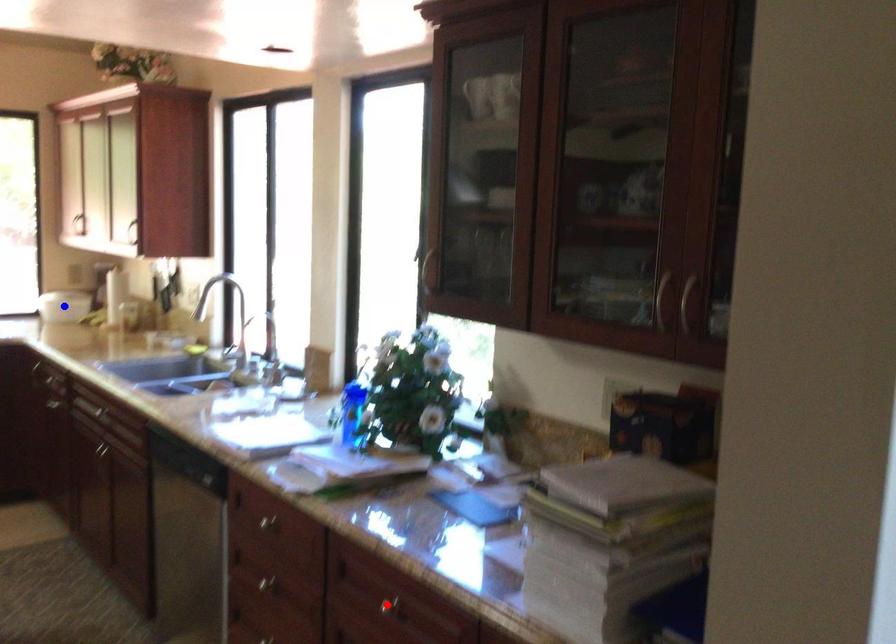
Question: Which of the two points in the image is closer to the camera?

Choices:
 (A) Blue point is closer.
 (B) Red point is closer.

Answer: (B)